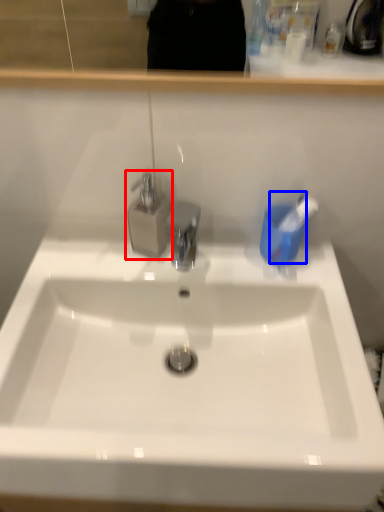
Question: Which point is further to the camera, tap (highlighted by a red box) or toothbrush (highlighted by a blue box)?

Choices:
 (A) tap
 (B) toothbrush

Answer: (B)